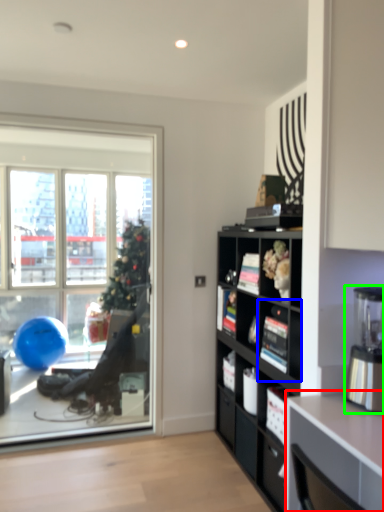
Question: Which is nearer to the desk (highlighted by a red box)? shelf (highlighted by a blue box) or coffee machine (highlighted by a green box).

Choices:
 (A) shelf
 (B) coffee machine

Answer: (B)